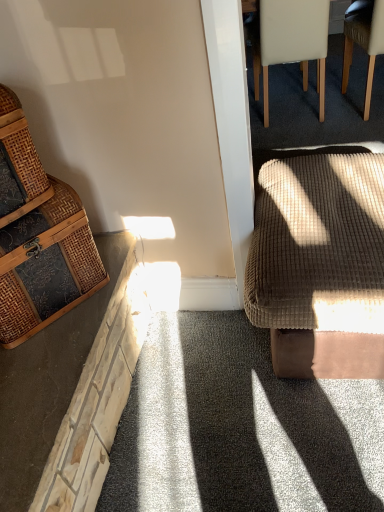
Question: From the image's perspective, is woven brown basket at left above woven rattan chest at left, which ranks as the 1th chair in left-to-right order?

Choices:
 (A) no
 (B) yes

Answer: (B)

Question: Does woven brown basket at left lie behind woven rattan chest at left, which ranks as the 1th chair in left-to-right order?

Choices:
 (A) yes
 (B) no

Answer: (B)

Question: Is woven brown basket at left outside woven rattan chest at left, acting as the 3th chair starting from the back?

Choices:
 (A) no
 (B) yes

Answer: (B)

Question: Can you confirm if woven brown basket at left is thinner than woven rattan chest at left, which ranks as the 1th chair in bottom-to-top order?

Choices:
 (A) no
 (B) yes

Answer: (B)

Question: Considering the relative sizes of woven brown basket at left and woven rattan chest at left, the first chair when ordered from front to back, in the image provided, is woven brown basket at left taller than woven rattan chest at left, the first chair when ordered from front to back,?

Choices:
 (A) no
 (B) yes

Answer: (A)

Question: From the image's perspective, relative to woven rattan chest at left, acting as the 3th chair starting from the back, is brown fabric chair at upper right, the 2th chair when ordered from back to front, above or below?

Choices:
 (A) below
 (B) above

Answer: (B)

Question: In terms of width, does brown fabric chair at upper right, the 2th chair when ordered from front to back, look wider or thinner when compared to woven rattan chest at left, the third chair positioned from the top?

Choices:
 (A) wide
 (B) thin

Answer: (A)

Question: Choose the correct answer: Is brown fabric chair at upper right, marked as the second chair in a bottom-to-top arrangement, inside woven rattan chest at left, which ranks as the 1th chair in left-to-right order, or outside it?

Choices:
 (A) inside
 (B) outside

Answer: (B)

Question: From a real-world perspective, is brown fabric chair at upper right, marked as the second chair in a bottom-to-top arrangement, above or below woven rattan chest at left, the third chair positioned from the top?

Choices:
 (A) above
 (B) below

Answer: (B)

Question: From a real-world perspective, is brown fabric chair at upper right, which is the first chair in right-to-left order, above or below velvet brown footstool at right?

Choices:
 (A) above
 (B) below

Answer: (A)

Question: Does point (377, 44) appear closer or farther from the camera than point (274, 185)?

Choices:
 (A) farther
 (B) closer

Answer: (A)

Question: Considering the positions of brown fabric chair at upper right, the 2th chair when ordered from back to front, and velvet brown footstool at right in the image, is brown fabric chair at upper right, the 2th chair when ordered from back to front, bigger or smaller than velvet brown footstool at right?

Choices:
 (A) small
 (B) big

Answer: (A)

Question: In the image, is brown fabric chair at upper right, the 2th chair when ordered from front to back, on the left side or the right side of velvet brown footstool at right?

Choices:
 (A) right
 (B) left

Answer: (A)

Question: From their relative heights in the image, would you say woven brown basket at left is taller or shorter than brown fabric chair at upper right, arranged as the third chair when viewed from the left?

Choices:
 (A) short
 (B) tall

Answer: (A)

Question: In terms of width, does woven brown basket at left look wider or thinner when compared to brown fabric chair at upper right, which is the first chair in right-to-left order?

Choices:
 (A) wide
 (B) thin

Answer: (B)